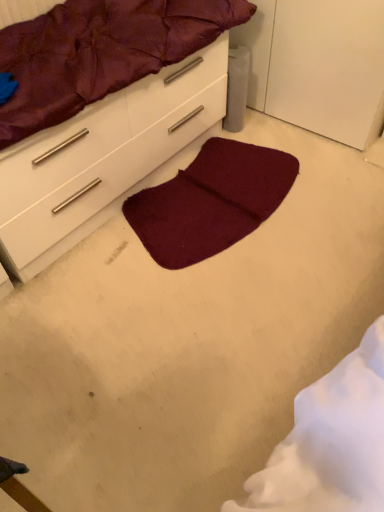
Question: Considering the relative sizes of matte white chest of drawers at center and burgundy plush mat at center in the image provided, is matte white chest of drawers at center bigger than burgundy plush mat at center?

Choices:
 (A) yes
 (B) no

Answer: (A)

Question: Is matte white chest of drawers at center in contact with burgundy plush mat at center?

Choices:
 (A) yes
 (B) no

Answer: (B)

Question: Can you confirm if matte white chest of drawers at center is taller than burgundy plush mat at center?

Choices:
 (A) yes
 (B) no

Answer: (A)

Question: Considering the relative sizes of matte white chest of drawers at center and burgundy plush mat at center in the image provided, is matte white chest of drawers at center smaller than burgundy plush mat at center?

Choices:
 (A) no
 (B) yes

Answer: (A)

Question: Is matte white chest of drawers at center shorter than burgundy plush mat at center?

Choices:
 (A) yes
 (B) no

Answer: (B)

Question: From the image's perspective, is burgundy fabric mattress at upper center positioned above or below burgundy plush mat at center?

Choices:
 (A) below
 (B) above

Answer: (B)

Question: In terms of width, does burgundy fabric mattress at upper center look wider or thinner when compared to burgundy plush mat at center?

Choices:
 (A) thin
 (B) wide

Answer: (A)

Question: From a real-world perspective, is burgundy fabric mattress at upper center physically located above or below burgundy plush mat at center?

Choices:
 (A) above
 (B) below

Answer: (A)

Question: Is burgundy fabric mattress at upper center taller or shorter than burgundy plush mat at center?

Choices:
 (A) short
 (B) tall

Answer: (B)

Question: Is point (261, 150) positioned closer to the camera than point (168, 92)?

Choices:
 (A) farther
 (B) closer

Answer: (A)

Question: Is burgundy plush mat at center wider or thinner than matte white chest of drawers at center?

Choices:
 (A) thin
 (B) wide

Answer: (A)

Question: From the image's perspective, is burgundy plush mat at center positioned above or below matte white chest of drawers at center?

Choices:
 (A) above
 (B) below

Answer: (B)

Question: Would you say burgundy plush mat at center is to the left or to the right of matte white chest of drawers at center in the picture?

Choices:
 (A) left
 (B) right

Answer: (B)

Question: From a real-world perspective, is matte white chest of drawers at center physically located above or below burgundy fabric mattress at upper center?

Choices:
 (A) above
 (B) below

Answer: (B)

Question: Looking at the image, does matte white chest of drawers at center seem bigger or smaller compared to burgundy fabric mattress at upper center?

Choices:
 (A) big
 (B) small

Answer: (A)